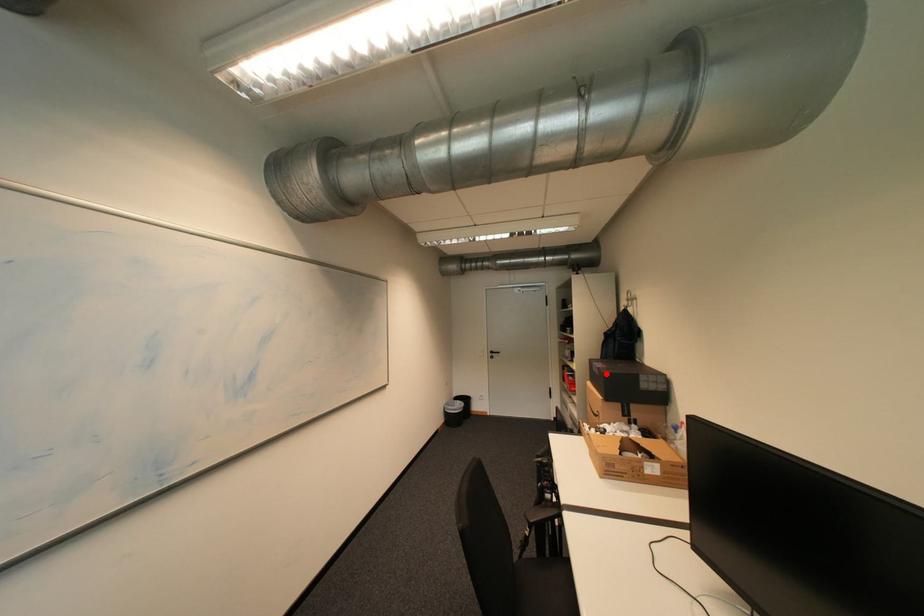
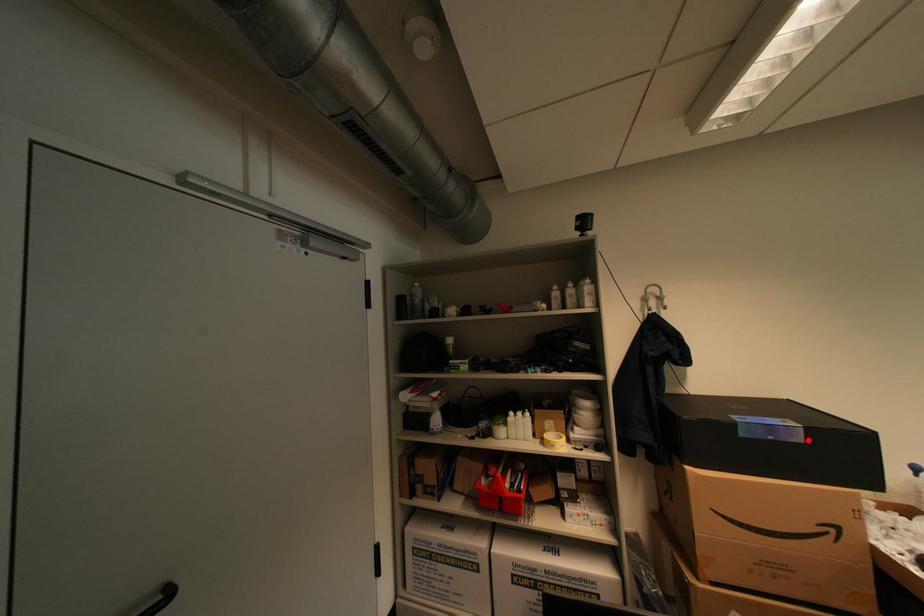
I am providing you with two images of the same scene from different viewpoints. A red point is marked on the first image and another point is marked on the second image. Does the point marked in image1 correspond to the same location as the one in image2?

Yes